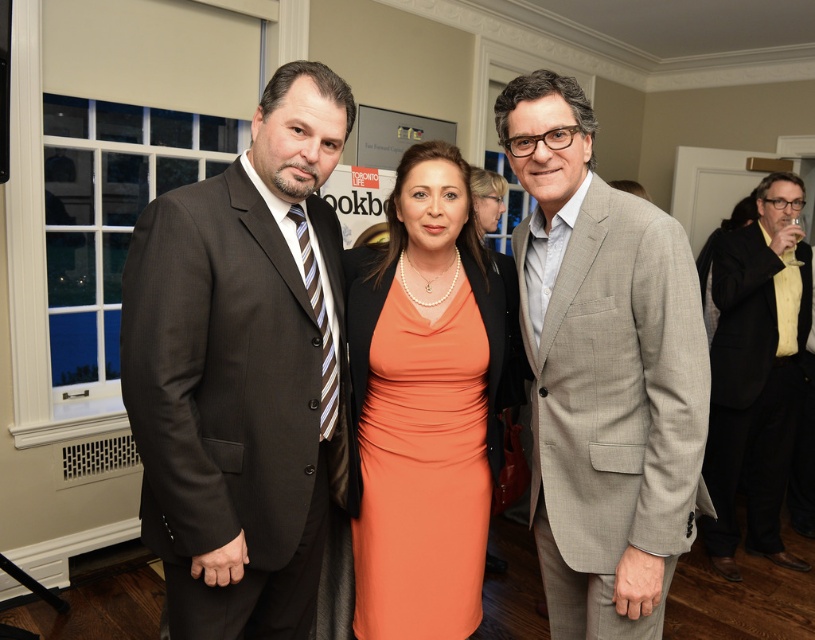
You are standing in the room and want to take a photo of the dark brown suit at left. Where should you position yourself to capture it in the frame?

To capture the dark brown suit at left in the frame, position yourself facing the left side of the room, as the dark brown suit at left is located at point [243,371].

You are standing in the room and want to greet the person in the dark brown suit at left. Which direction should you walk to approach them without passing behind the black textured suit at right?

The dark brown suit at left is in front of the black textured suit at right, so you should walk towards the left side of the room to approach them directly without going behind the black textured suit at right.